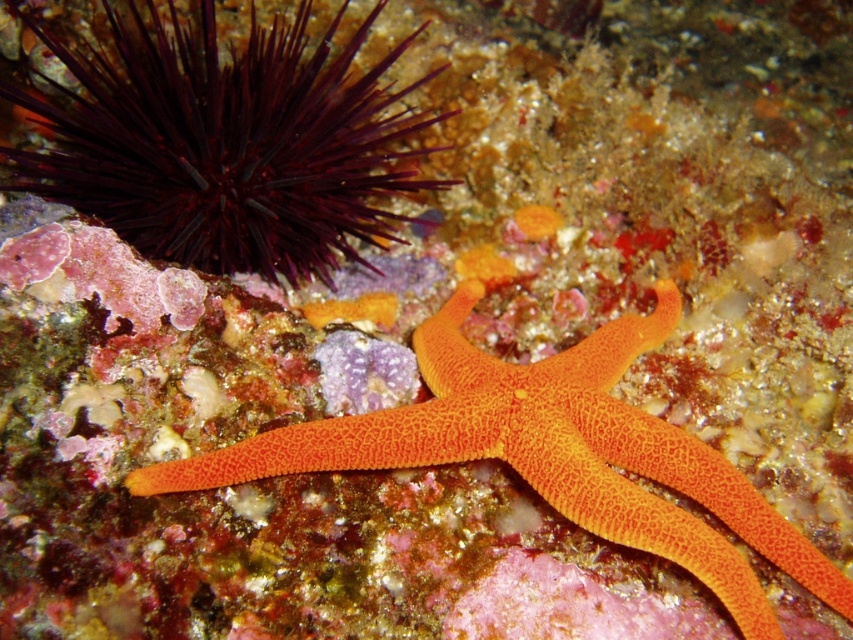
You are a marine biologist studying underwater life. You observe a bright orange starfish in the foreground and a dark spiny sea urchin at upper left. According to your coordinates, the point at (x=225, y=144) marks the location of the dark spiny sea urchin at upper left. Can you determine which object is closer to you based on their positions?

The bright orange starfish in the foreground is closer to you than the dark spiny sea urchin at upper left marked by point (x=225, y=144).

You are a marine biologist observing an underwater scene. You notice two points of interest labeled as point (314, 60) and point (524, 396). Which point is closer to your observation equipment located at the camera position?

Point (314, 60) is further to the camera than point (524, 396), so the point closer to the camera is point (524, 396).